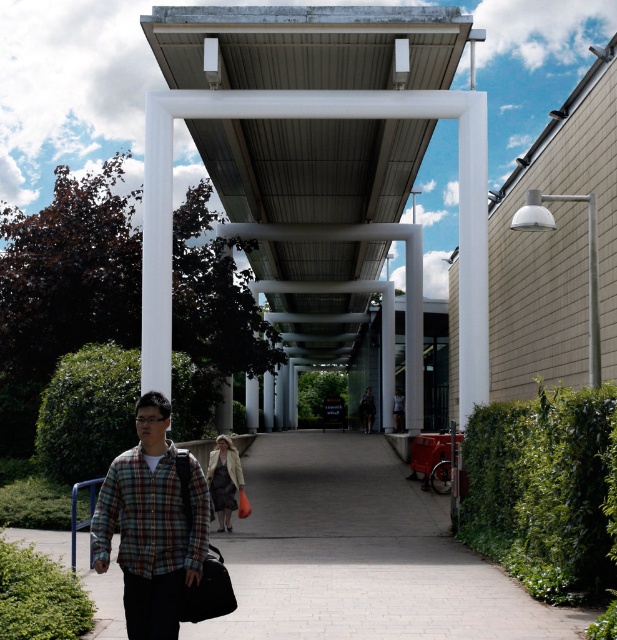
Between point (133, 488) and point (373, 420), which one is positioned in front?

Point (133, 488)

Does plaid flannel shirt at lower left have a larger size compared to dark gray fabric jacket at center?

No, plaid flannel shirt at lower left is not bigger than dark gray fabric jacket at center.

Does point (162, 576) lie behind point (365, 396)?

That is False.

The image size is (617, 640). I want to click on plaid flannel shirt at lower left, so click(151, 524).